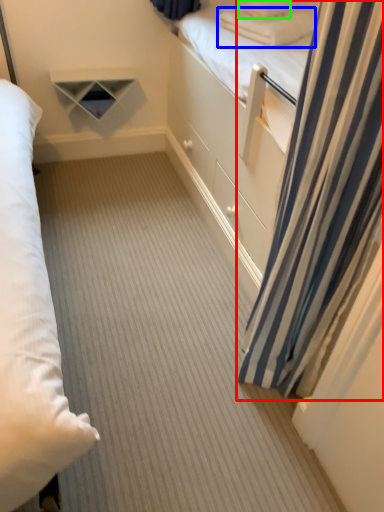
Question: Based on their relative distances, which object is farther from curtain (highlighted by a red box)? Choose from pillow (highlighted by a blue box) and pillow (highlighted by a green box).

Choices:
 (A) pillow
 (B) pillow

Answer: (B)